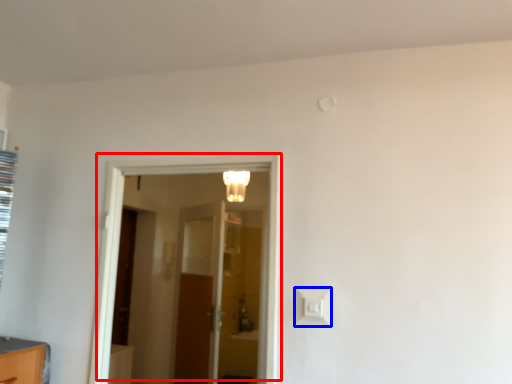
Question: Which point is closer to the camera, door (highlighted by a red box) or light switch (highlighted by a blue box)?

Choices:
 (A) door
 (B) light switch

Answer: (B)